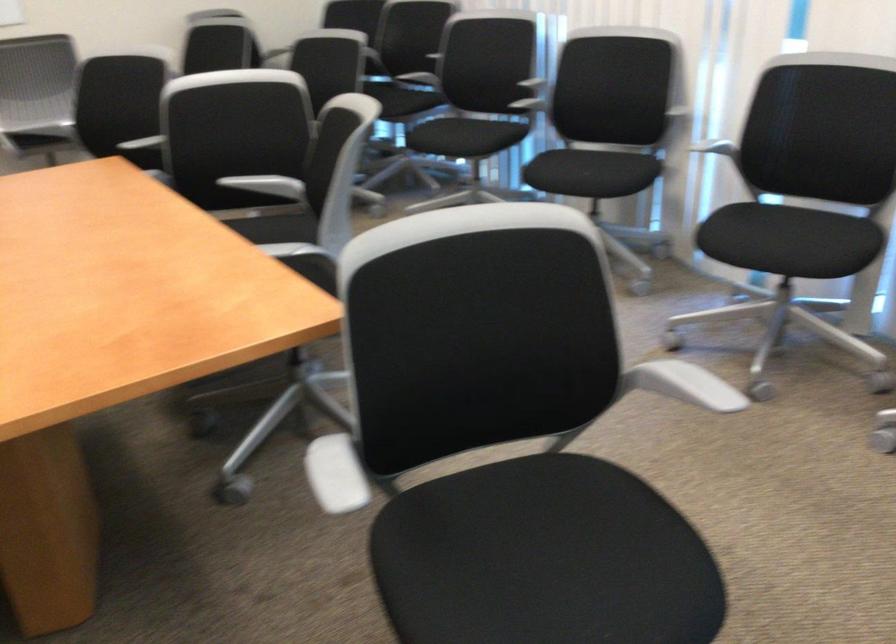
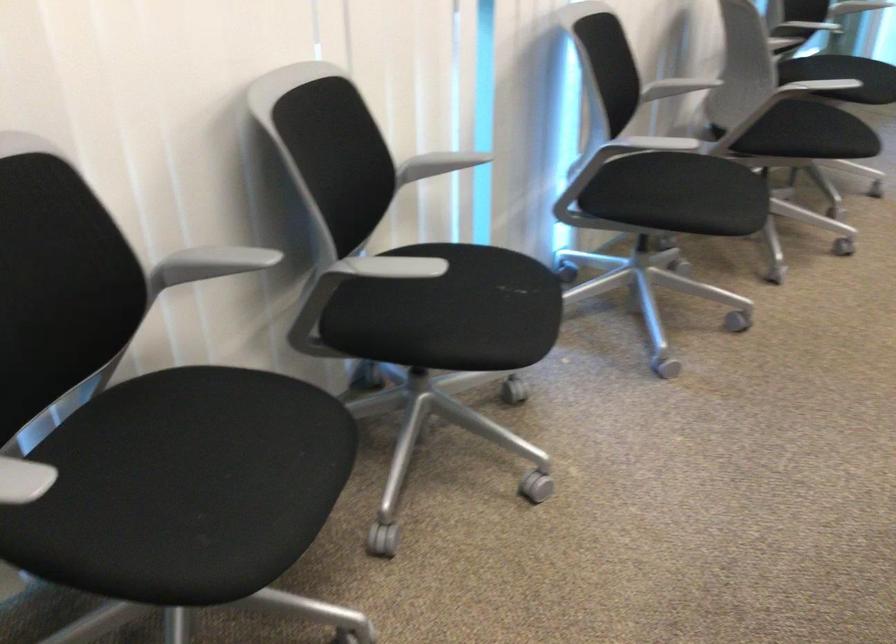
Where in the second image is the point corresponding to the point at 670,113 from the first image?

(438, 164)